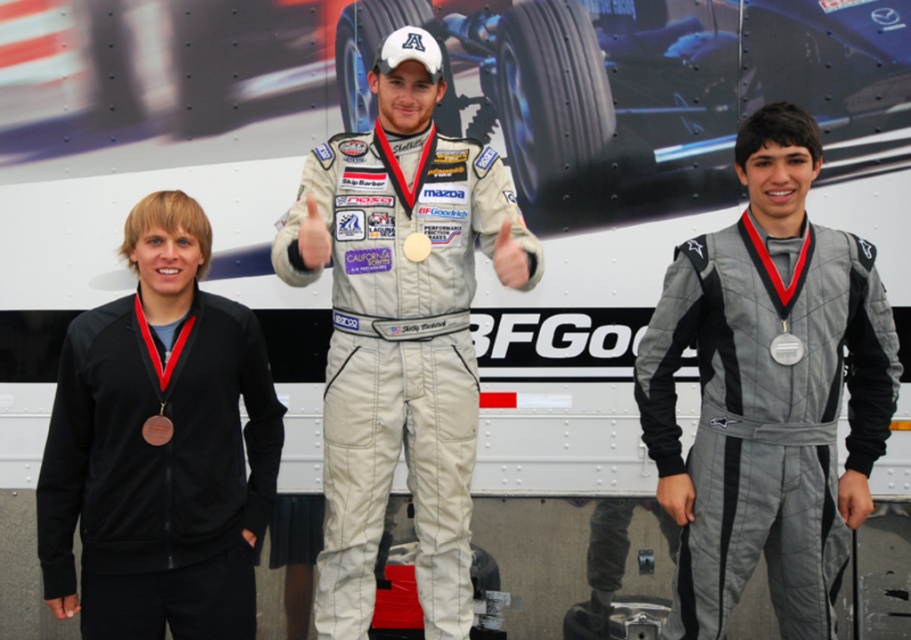
Is matte white racing suit at center to the right of silver metallic medal at center from the viewer's perspective?

Incorrect, matte white racing suit at center is not on the right side of silver metallic medal at center.

Between matte white racing suit at center and silver metallic medal at center, which one is positioned higher?

matte white racing suit at center is higher up.

At what (x,y) coordinates should I click in order to perform the action: click on matte white racing suit at center. Please return your answer as a coordinate pair (x, y). The width and height of the screenshot is (911, 640). Looking at the image, I should click on (401, 330).

Where is `matte white racing suit at center`? matte white racing suit at center is located at coordinates (401, 330).

Is quilted gray jumpsuit at center thinner than black fabric jacket at left?

No.

Image resolution: width=911 pixels, height=640 pixels. Describe the element at coordinates (768, 392) in the screenshot. I see `quilted gray jumpsuit at center` at that location.

Between point (752, 298) and point (108, 346), which one is positioned in front?

Point (108, 346) is more forward.

Where is `quilted gray jumpsuit at center`? This screenshot has width=911, height=640. quilted gray jumpsuit at center is located at coordinates (768, 392).

Does matte white racing suit at center appear under black fabric jacket at left?

No, matte white racing suit at center is not below black fabric jacket at left.

What do you see at coordinates (401, 330) in the screenshot? I see `matte white racing suit at center` at bounding box center [401, 330].

This screenshot has height=640, width=911. What are the coordinates of `matte white racing suit at center` in the screenshot? It's located at (401, 330).